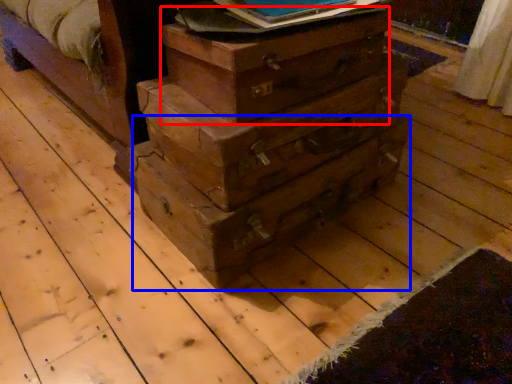
Question: Which point is closer to the camera, crate (highlighted by a red box) or drawer (highlighted by a blue box)?

Choices:
 (A) crate
 (B) drawer

Answer: (A)